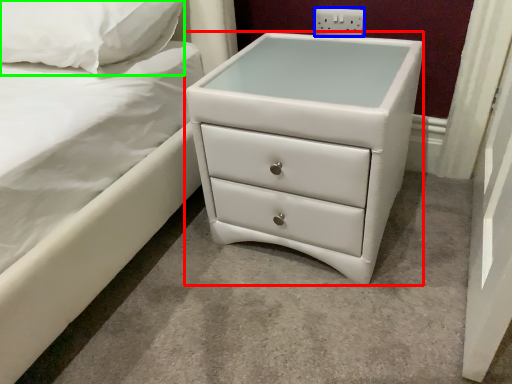
Question: Which object is the farthest from chest of drawers (highlighted by a red box)? Choose among these: electric outlet (highlighted by a blue box) or pillow (highlighted by a green box).

Choices:
 (A) electric outlet
 (B) pillow

Answer: (B)